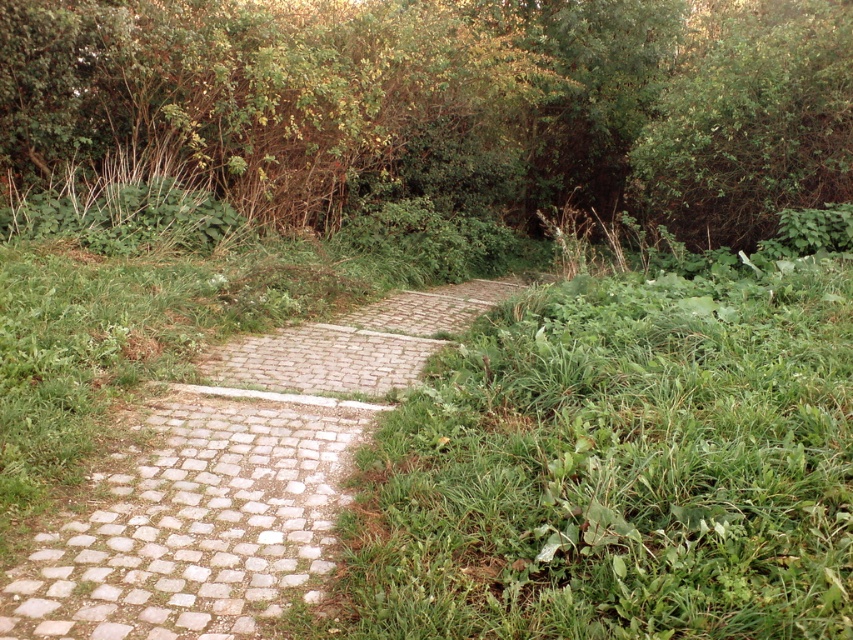
Question: Which point is farther to the camera?

Choices:
 (A) pyautogui.click(x=241, y=45)
 (B) pyautogui.click(x=437, y=342)

Answer: (A)

Question: Can you confirm if green leafy bush at upper center is positioned below pebble stone path at center?

Choices:
 (A) no
 (B) yes

Answer: (A)

Question: Which object appears closest to the camera in this image?

Choices:
 (A) pebble stone path at center
 (B) green leafy bush at upper center

Answer: (A)

Question: Can you confirm if green leafy bush at upper center is thinner than pebble stone path at center?

Choices:
 (A) yes
 (B) no

Answer: (B)

Question: Is green leafy bush at upper center positioned before pebble stone path at center?

Choices:
 (A) no
 (B) yes

Answer: (A)